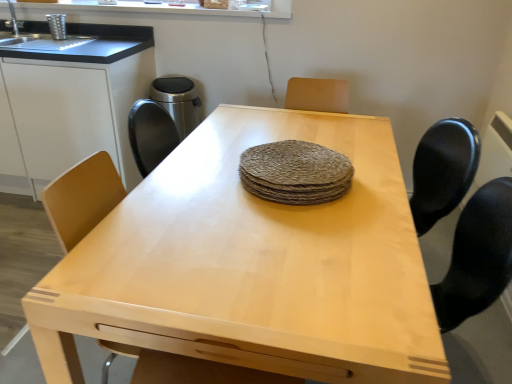
You are a GUI agent. You are given a task and a screenshot of the screen. Output one action in this format:
    pyautogui.click(x=<x>, y=<y>)
    Task: Click on the vacant area that is situated to the right of rough woven placemat at center
    
    Given the screenshot: What is the action you would take?
    pyautogui.click(x=377, y=181)